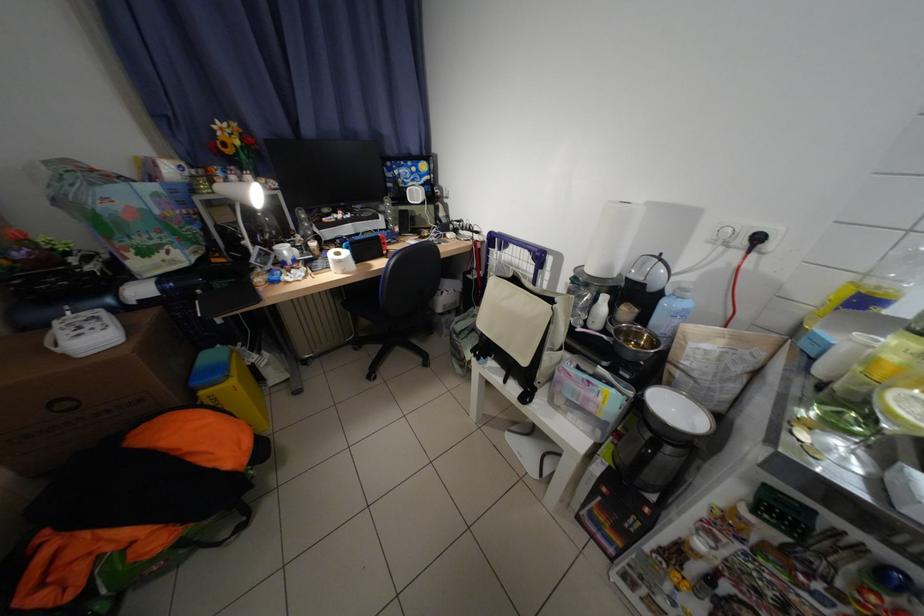
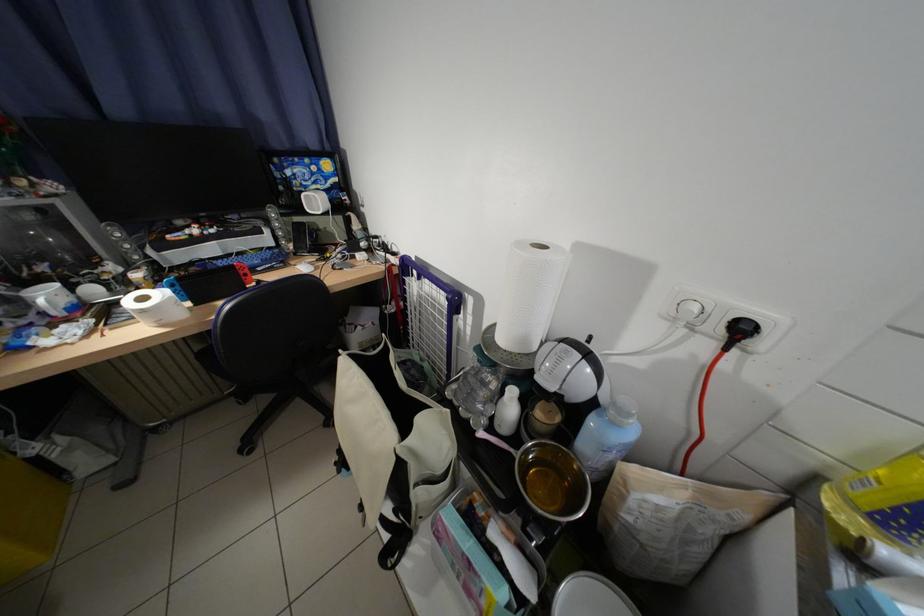
Find the pixel in the second image that matches (x=782, y=246) in the first image.

(772, 345)